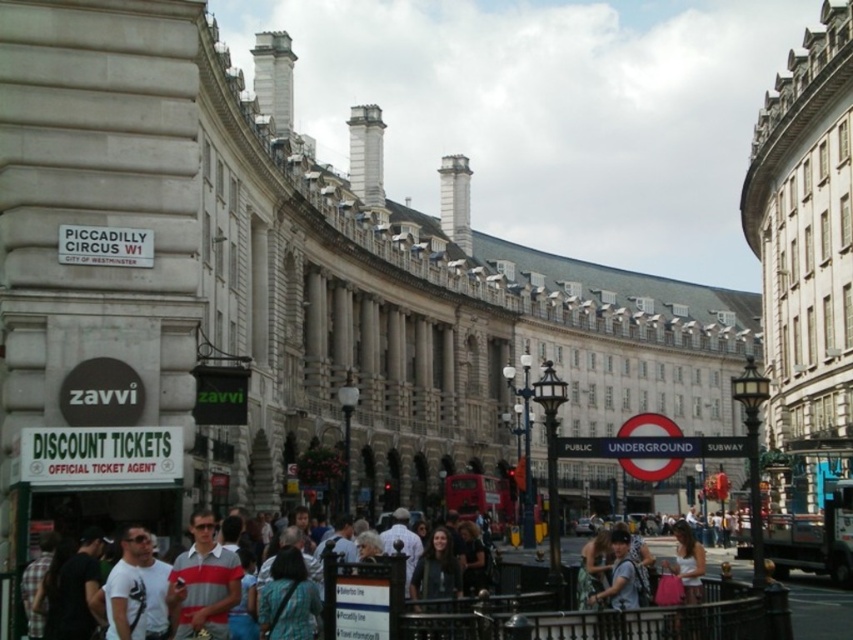
You are a street performer planning to juggle fire torches. You are standing at the center of Piccadilly Circus near the light blue shirt at center and the striped polo shirt at center. The fire torches have a safety radius of 3 meters to ensure no one gets hurt. Will the distance between the two shirts be sufficient to safely perform your act without endangering them?

The distance between the light blue shirt at center and the striped polo shirt at center is 4.02 meters. Since the safety radius required is 3 meters, the distance is sufficient to safely perform the act without endangering them.

You are standing at Piccadilly Circus and want to take a photo of the iconic red Underground sign. There is a point at coordinates point (386, 572) that you might walk to. Considering the distance from your current position to this point, would walking to this point allow you to capture the entire Underground sign in your photo?

The distance of point (386, 572) from viewer is 47.31 meters. At this distance, you should be able to capture the entire Underground sign in your photo as it is a focal point in the scene and the distance is sufficient for a wide shot.